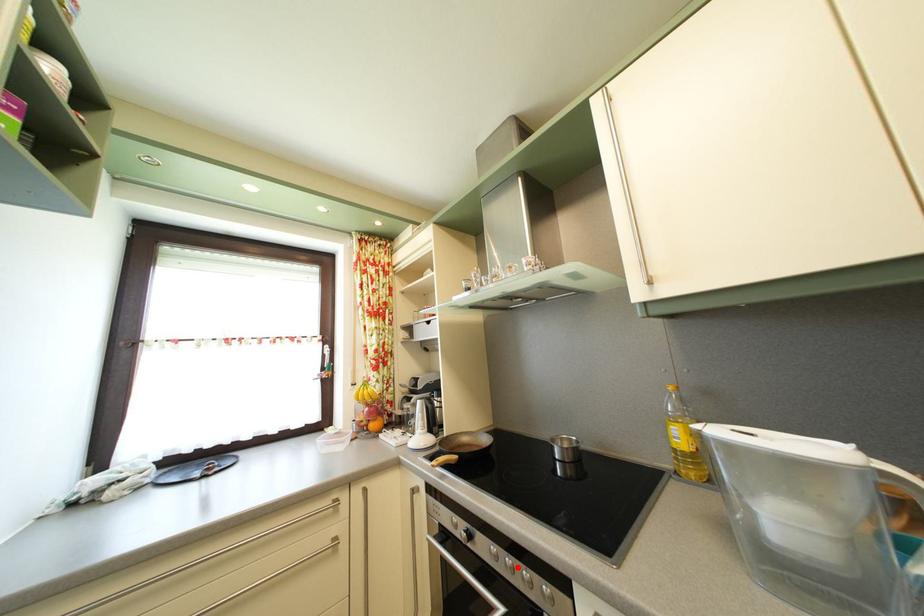
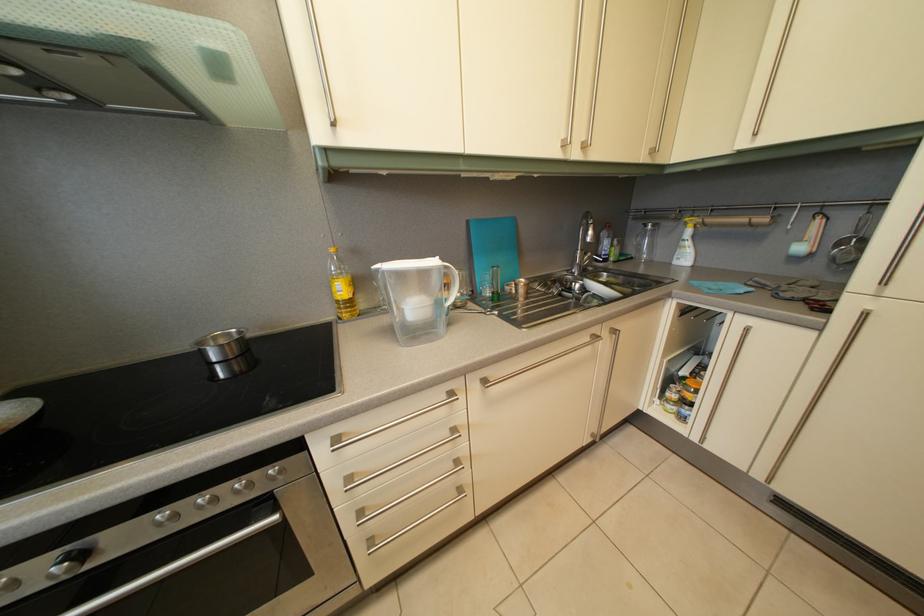
Question: A red point is marked in image1. In image2, is the corresponding 3D point closer to the camera or farther? Reply with the corresponding letter.

Choices:
 (A) The corresponding 3D point is closer.
 (B) The corresponding 3D point is farther.

Answer: (A)